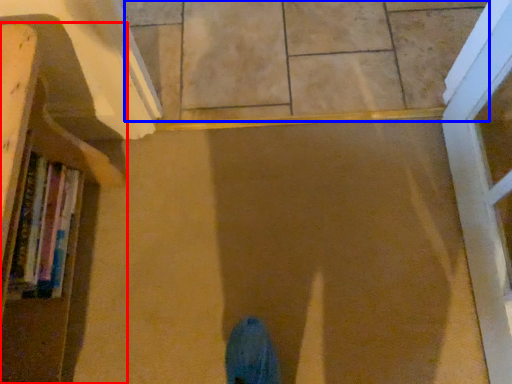
Question: Which object is further to the camera taking this photo, bookcase (highlighted by a red box) or tile (highlighted by a blue box)?

Choices:
 (A) bookcase
 (B) tile

Answer: (B)